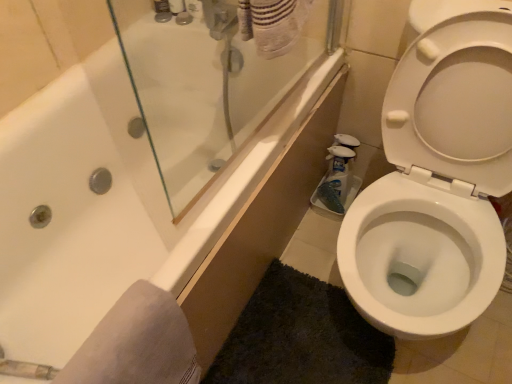
Question: Is the position of white plastic bottle at upper center, which appears as the first toiletry when viewed from the right, less distant than that of white glossy toilet at right?

Choices:
 (A) no
 (B) yes

Answer: (A)

Question: Is white plastic bottle at upper center, which appears as the first toiletry when viewed from the right, to the left of white glossy toilet at right from the viewer's perspective?

Choices:
 (A) yes
 (B) no

Answer: (A)

Question: Is white plastic bottle at upper center, which ranks as the third toiletry in left-to-right order, touching white glossy toilet at right?

Choices:
 (A) no
 (B) yes

Answer: (A)

Question: From the image's perspective, does white plastic bottle at upper center, which ranks as the third toiletry in left-to-right order, appear lower than white glossy toilet at right?

Choices:
 (A) yes
 (B) no

Answer: (B)

Question: From a real-world perspective, is white plastic bottle at upper center, which appears as the first toiletry when viewed from the right, on top of white glossy toilet at right?

Choices:
 (A) yes
 (B) no

Answer: (A)

Question: Is white plastic bottle at upper center, which ranks as the third toiletry in left-to-right order, bigger than white glossy toilet at right?

Choices:
 (A) yes
 (B) no

Answer: (B)

Question: Is white plastic bottle at upper center, which appears as the first toiletry when viewed from the right, positioned beyond the bounds of dark gray shaggy bath mat at lower right?

Choices:
 (A) no
 (B) yes

Answer: (B)

Question: From a real-world perspective, is white plastic bottle at upper center, which appears as the first toiletry when viewed from the right, located beneath dark gray shaggy bath mat at lower right?

Choices:
 (A) no
 (B) yes

Answer: (A)

Question: Is white plastic bottle at upper center, which ranks as the third toiletry in left-to-right order, wider than dark gray shaggy bath mat at lower right?

Choices:
 (A) no
 (B) yes

Answer: (A)

Question: Is there a large distance between white plastic bottle at upper center, which appears as the first toiletry when viewed from the right, and dark gray shaggy bath mat at lower right?

Choices:
 (A) no
 (B) yes

Answer: (B)

Question: Is white plastic bottle at upper center, which ranks as the third toiletry in left-to-right order, facing towards dark gray shaggy bath mat at lower right?

Choices:
 (A) yes
 (B) no

Answer: (B)

Question: Is white plastic bottle at upper center, which appears as the first toiletry when viewed from the right, to the left of dark gray shaggy bath mat at lower right from the viewer's perspective?

Choices:
 (A) no
 (B) yes

Answer: (B)

Question: Is dark gray shaggy bath mat at lower right taller than white glossy toilet at right?

Choices:
 (A) yes
 (B) no

Answer: (B)